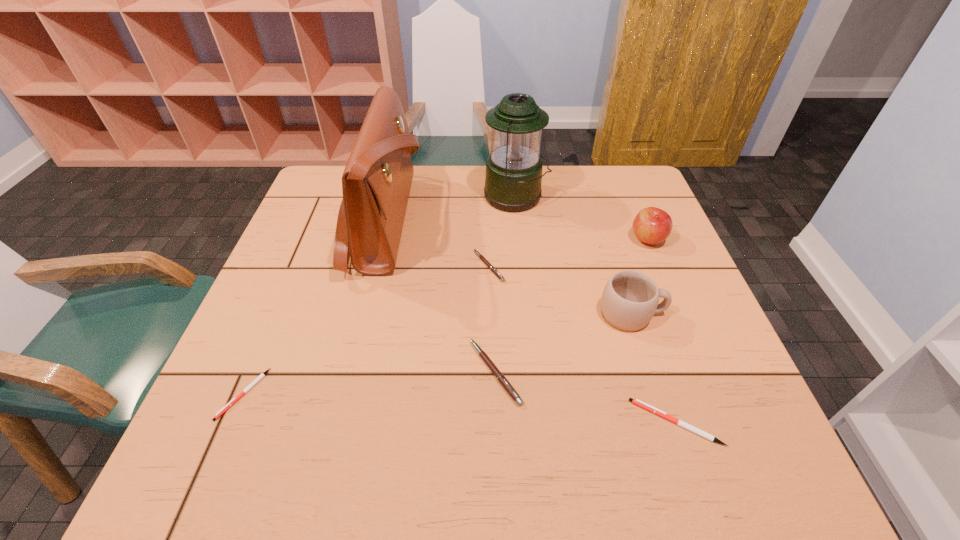
The image size is (960, 540). Find the location of `pen that is at the left edge`. pen that is at the left edge is located at coordinates (227, 406).

The width and height of the screenshot is (960, 540). I want to click on apple that is positioned at the right edge, so click(652, 225).

Locate an element on the screen. Image resolution: width=960 pixels, height=540 pixels. mug located at the right edge is located at coordinates (630, 299).

Identify the location of pen situated at the right edge. (637, 402).

The width and height of the screenshot is (960, 540). I want to click on object that is at the far left corner, so click(x=376, y=182).

Locate an element on the screen. This screenshot has width=960, height=540. object present at the near right corner is located at coordinates (637, 402).

In the image, there is a desktop. Find the location of `free space at the far edge`. free space at the far edge is located at coordinates (437, 205).

I want to click on free space at the near edge of the desktop, so click(x=485, y=439).

In the image, there is a desktop. Where is `vacant space at the left edge`? vacant space at the left edge is located at coordinates (274, 400).

Locate an element on the screen. This screenshot has height=540, width=960. vacant space at the right edge of the desktop is located at coordinates (658, 319).